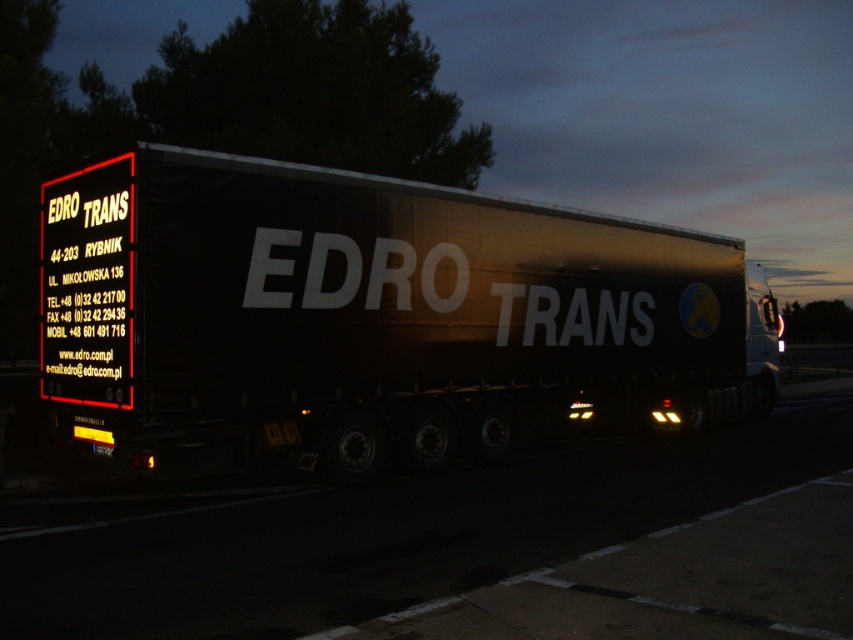
Question: Is glossy black trailer at center to the left of black matte sign at upper left from the viewer's perspective?

Choices:
 (A) yes
 (B) no

Answer: (B)

Question: Is metallic silver trailer at center further to the viewer compared to black matte sign at upper left?

Choices:
 (A) yes
 (B) no

Answer: (B)

Question: Which of the following is the closest to the observer?

Choices:
 (A) (108, 291)
 (B) (242, 195)

Answer: (A)

Question: Is metallic silver trailer at center positioned at the back of glossy black trailer at center?

Choices:
 (A) yes
 (B) no

Answer: (B)

Question: Considering the real-world distances, which object is farthest from the metallic silver trailer at center?

Choices:
 (A) glossy black trailer at center
 (B) black matte sign at upper left

Answer: (A)

Question: Estimate the real-world distances between objects in this image. Which object is farther from the glossy black trailer at center?

Choices:
 (A) metallic silver trailer at center
 (B) black matte sign at upper left

Answer: (A)